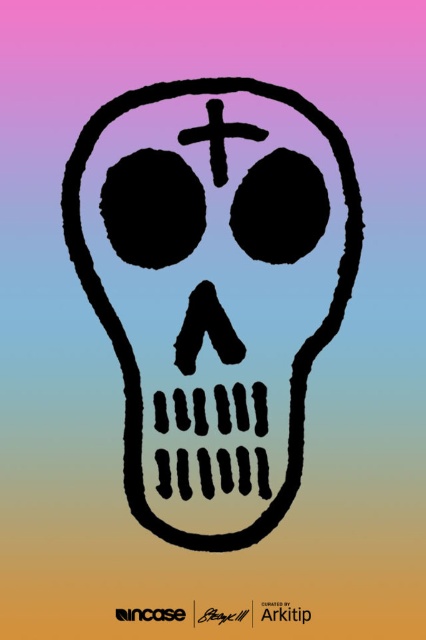
Based on the scene description, which object is wider between the black matte skull at center and the black matte cross at center?

The black matte skull at center is wider than the black matte cross at center according to the description.

You are an artist trying to paint the skull in the image. You want to add a highlight on the point closer to you. Which point should you choose between point (74, 230) and point (264, 140)?

Point (74, 230) is further to the camera than point (264, 140), so you should choose point (74, 230) to add the highlight.

You are designing a tattoo and want to place the black matte skull at center and the black matte cross at center on the same area. The skin area you have is 8 inches wide. Can both fit side by side without overlapping?

The distance between the black matte skull at center and the black matte cross at center is 6.13 inches. Since the total space needed is 6.13 inches and the skin area is 8 inches wide, they can fit side by side with 1.87 inches of space remaining.